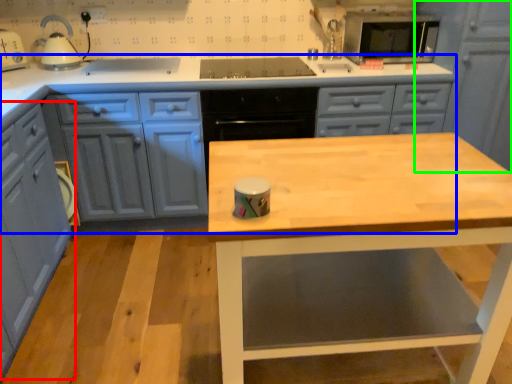
Question: Estimate the real-world distances between objects in this image. Which object is closer to cabinetry (highlighted by a red box), cabinetry (highlighted by a blue box) or cabinetry (highlighted by a green box)?

Choices:
 (A) cabinetry
 (B) cabinetry

Answer: (A)